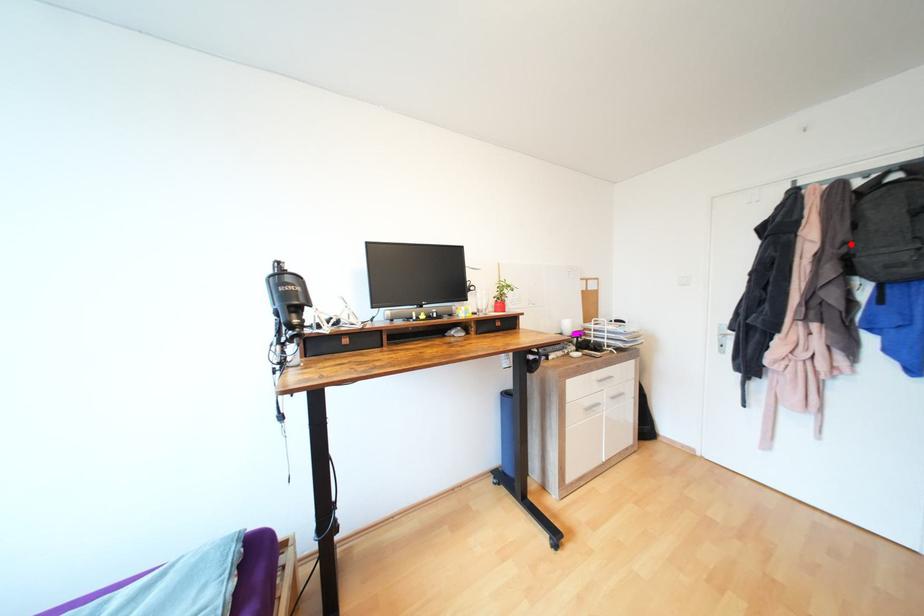
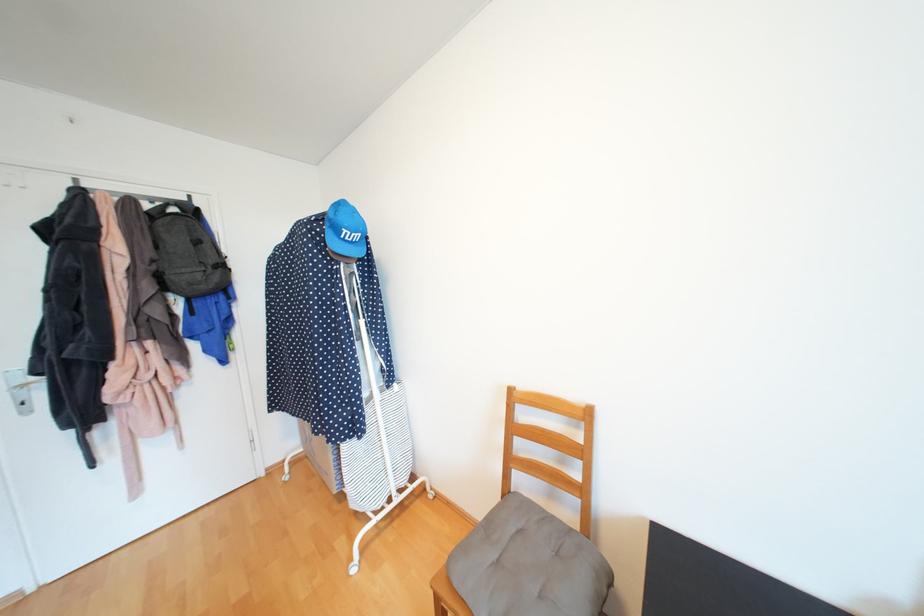
Find the pixel in the second image that matches the highlighted location in the first image.

(160, 262)